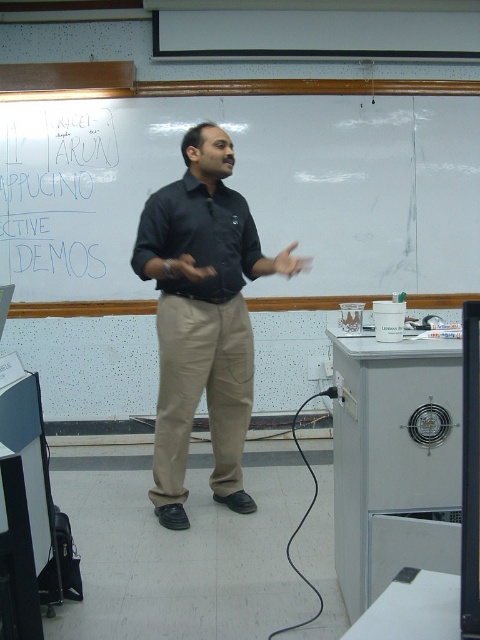
Question: Can you confirm if black shirt at center is positioned to the left of blue marker writing at upper left?

Choices:
 (A) yes
 (B) no

Answer: (B)

Question: Can you confirm if black shirt at center is wider than black matte shirt at center?

Choices:
 (A) no
 (B) yes

Answer: (B)

Question: Which of these objects is positioned farthest from the khaki pants at center?

Choices:
 (A) whiteboard at upper center
 (B) black matte shirt at center

Answer: (A)

Question: Which of the following is the closest to the observer?

Choices:
 (A) khaki pants at center
 (B) black shirt at center

Answer: (B)

Question: Estimate the real-world distances between objects in this image. Which object is farther from the khaki pants at center?

Choices:
 (A) black shirt at center
 (B) black matte shirt at center
 (C) whiteboard at upper center
 (D) blue marker writing at upper left

Answer: (D)

Question: Is whiteboard at upper center to the left of khaki pants at center from the viewer's perspective?

Choices:
 (A) yes
 (B) no

Answer: (B)